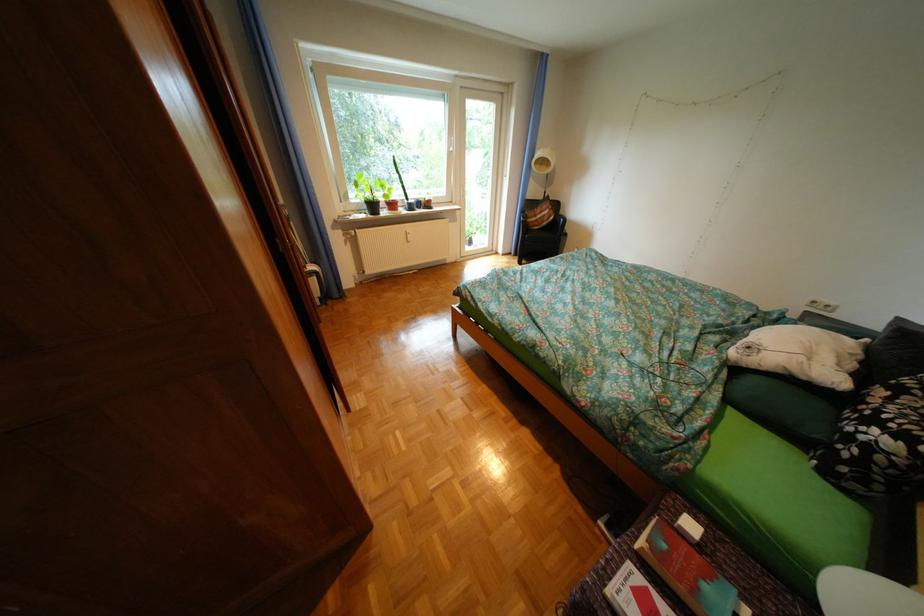
I want to click on patterned pillow, so click(x=878, y=440).